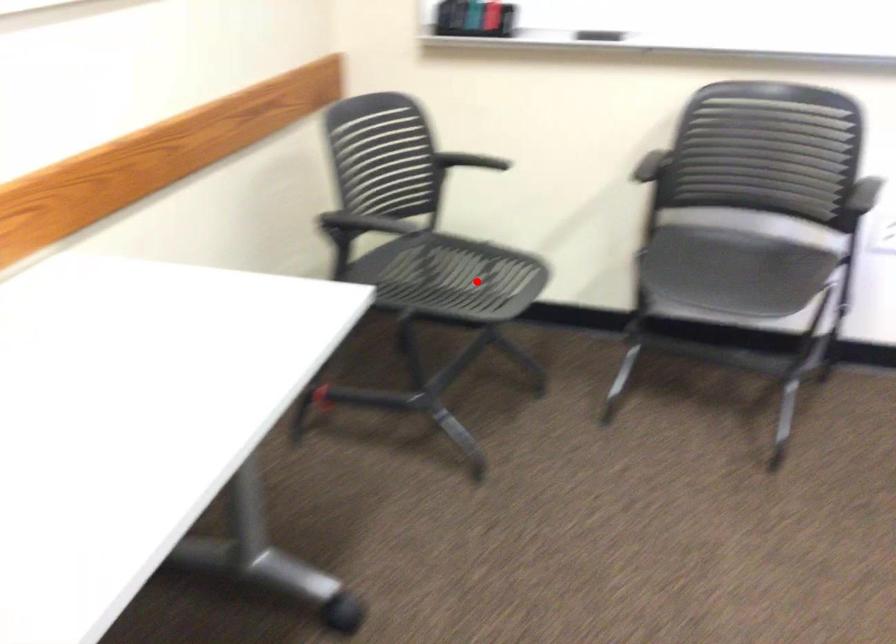
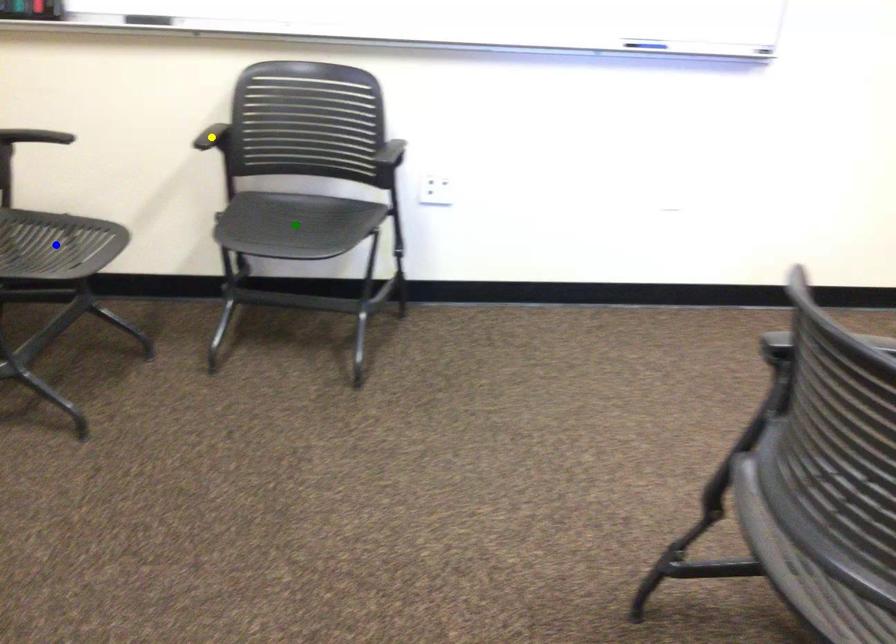
Question: I am providing you with two images of the same scene from different viewpoints. A red point is marked on the first image. You are given multiple points on the second image. Which spot in image 2 lines up with the point in image 1?

Choices:
 (A) blue point
 (B) yellow point
 (C) green point

Answer: (A)